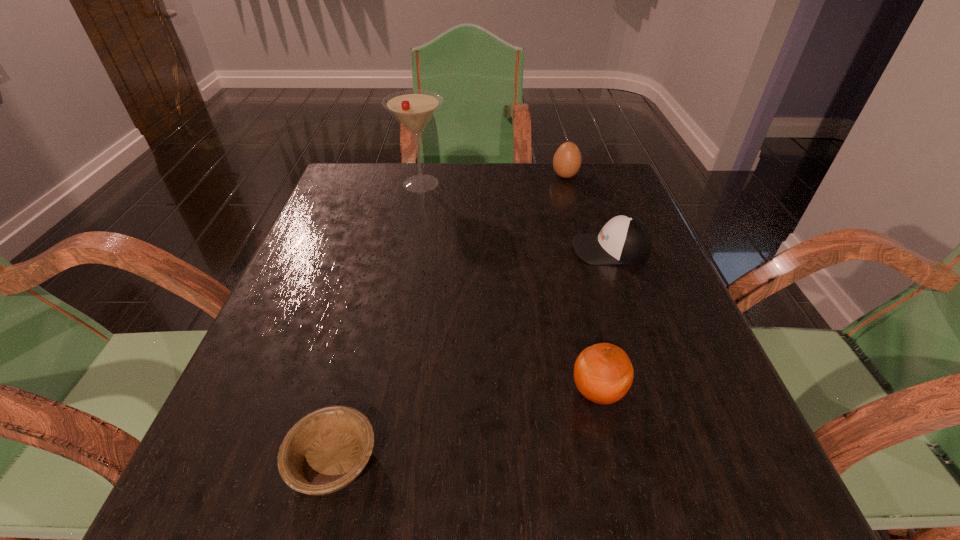
This screenshot has height=540, width=960. I want to click on vacant space situated 0.090m on the front panel of the second shortest object, so click(x=531, y=249).

You are a GUI agent. You are given a task and a screenshot of the screen. Output one action in this format:
    pyautogui.click(x=<x>, y=<y>)
    Task: Click on the vacant space located 0.340m on the front panel of the second shortest object
    
    Given the screenshot: What is the action you would take?
    pyautogui.click(x=414, y=249)

You are a GUI agent. You are given a task and a screenshot of the screen. Output one action in this format:
    pyautogui.click(x=<x>, y=<y>)
    Task: Click on the vacant space located on the front panel of the second shortest object
    This screenshot has width=960, height=540.
    Given the screenshot: What is the action you would take?
    pyautogui.click(x=390, y=249)

Image resolution: width=960 pixels, height=540 pixels. What are the coordinates of `free spot located on the right of the shortest object` in the screenshot? It's located at (554, 461).

You are a GUI agent. You are given a task and a screenshot of the screen. Output one action in this format:
    pyautogui.click(x=<x>, y=<y>)
    Task: Click on the martini situated at the far edge
    The image size is (960, 540).
    Given the screenshot: What is the action you would take?
    pyautogui.click(x=413, y=109)

Where is `boiled egg at the far edge`? boiled egg at the far edge is located at coordinates (567, 160).

Identify the location of object present at the near edge. [327, 449].

What are the coordinates of `martini that is at the left edge` in the screenshot? It's located at (413, 109).

The width and height of the screenshot is (960, 540). In order to click on bowl present at the left edge in this screenshot , I will do [x=327, y=449].

This screenshot has height=540, width=960. Identify the location of boiled egg that is positioned at the right edge. (567, 160).